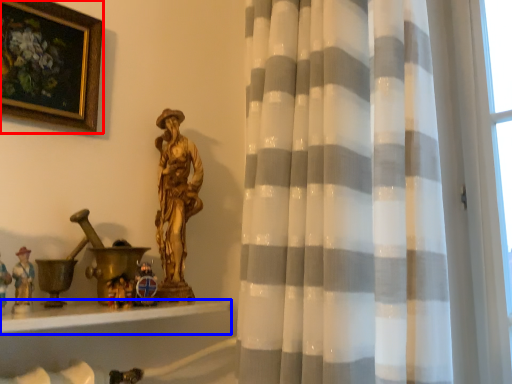
Question: Which object is further to the camera taking this photo, picture frame (highlighted by a red box) or window sill (highlighted by a blue box)?

Choices:
 (A) picture frame
 (B) window sill

Answer: (A)